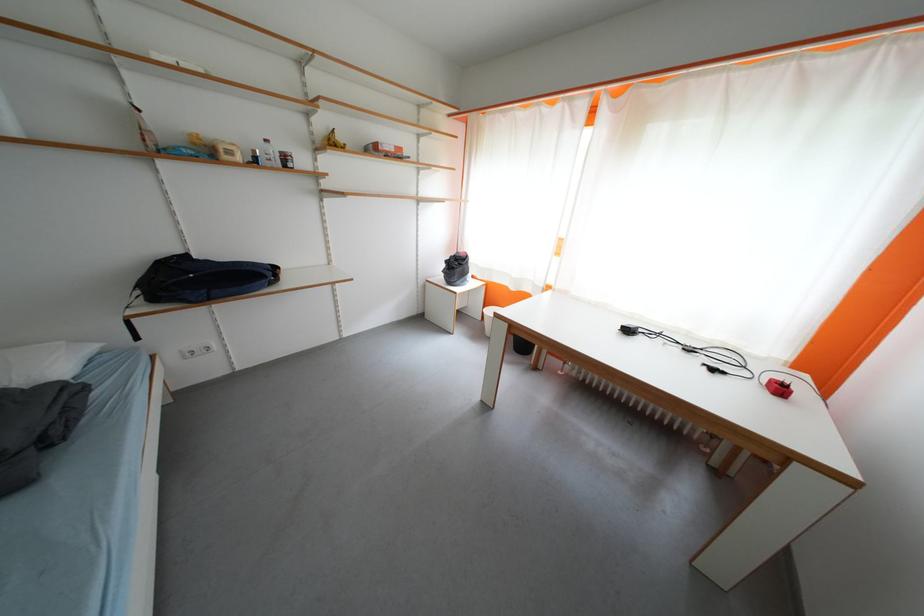
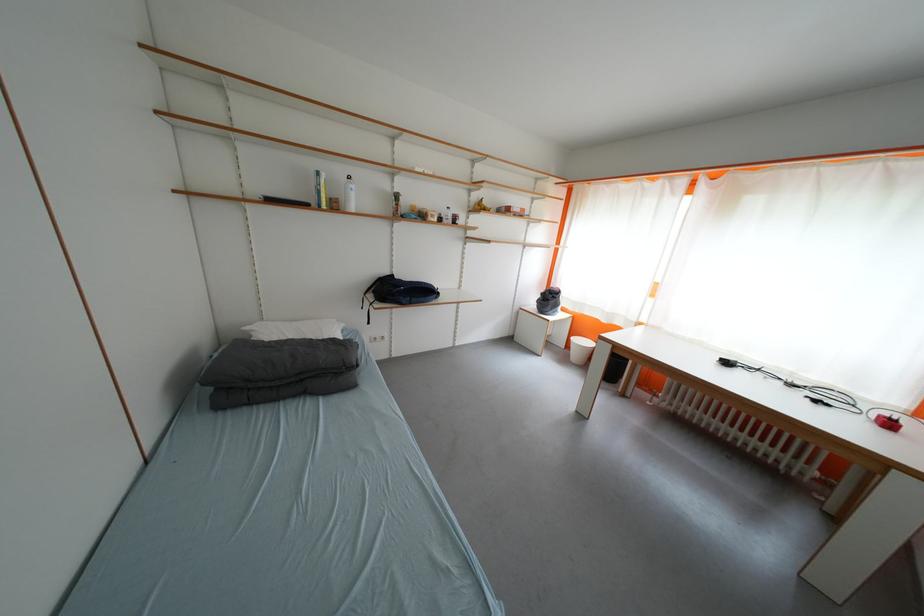
Find the pixel in the second image that matches point (196, 259) in the first image.

(400, 278)